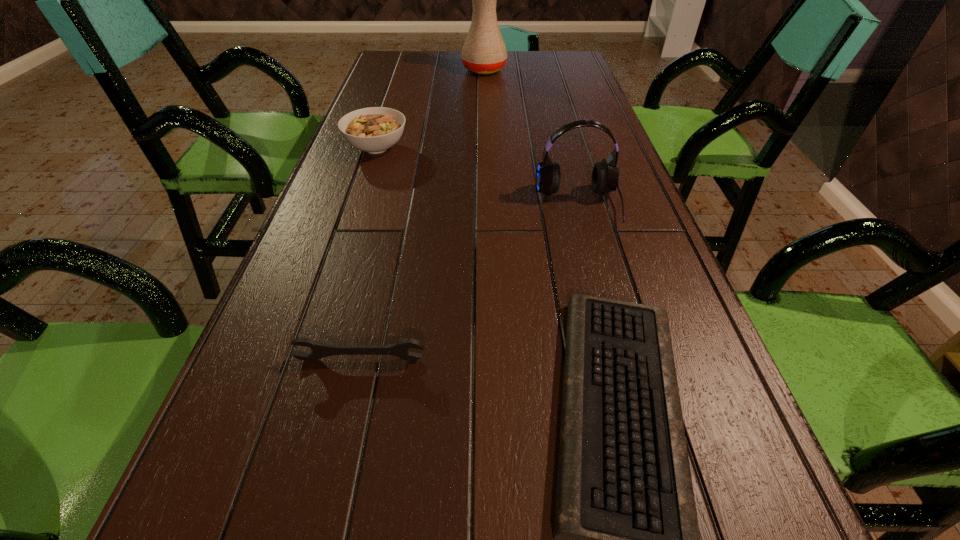
You are a GUI agent. You are given a task and a screenshot of the screen. Output one action in this format:
    pyautogui.click(x=<x>, y=<y>)
    Task: Click on the vacant region located 0.090m on the open ends of the second shortest object
    This screenshot has width=960, height=540.
    Given the screenshot: What is the action you would take?
    pyautogui.click(x=348, y=413)

At what (x,y) coordinates should I click in order to perform the action: click on object present at the far edge. Please return your answer as a coordinate pair (x, y). This screenshot has width=960, height=540. Looking at the image, I should click on (484, 52).

At what (x,y) coordinates should I click in order to perform the action: click on stew at the left edge. Please return your answer as a coordinate pair (x, y). This screenshot has height=540, width=960. Looking at the image, I should click on (375, 129).

The image size is (960, 540). What are the coordinates of `wrench that is at the left edge` in the screenshot? It's located at (319, 350).

Where is `object positioned at the right edge`? object positioned at the right edge is located at coordinates (605, 175).

In the image, there is a desktop. At what (x,y) coordinates should I click in order to perform the action: click on free space at the far edge. Please return your answer as a coordinate pair (x, y). This screenshot has width=960, height=540. Looking at the image, I should click on (462, 74).

Where is `vacant space at the left edge of the desktop`? This screenshot has height=540, width=960. vacant space at the left edge of the desktop is located at coordinates (280, 291).

In the image, there is a desktop. Find the location of `vacant space at the right edge`. vacant space at the right edge is located at coordinates (578, 102).

Find the location of a particular element. free space at the far left corner of the desktop is located at coordinates coord(380,63).

Image resolution: width=960 pixels, height=540 pixels. In the image, there is a desktop. Find the location of `vacant space at the far right corner`. vacant space at the far right corner is located at coordinates (557, 53).